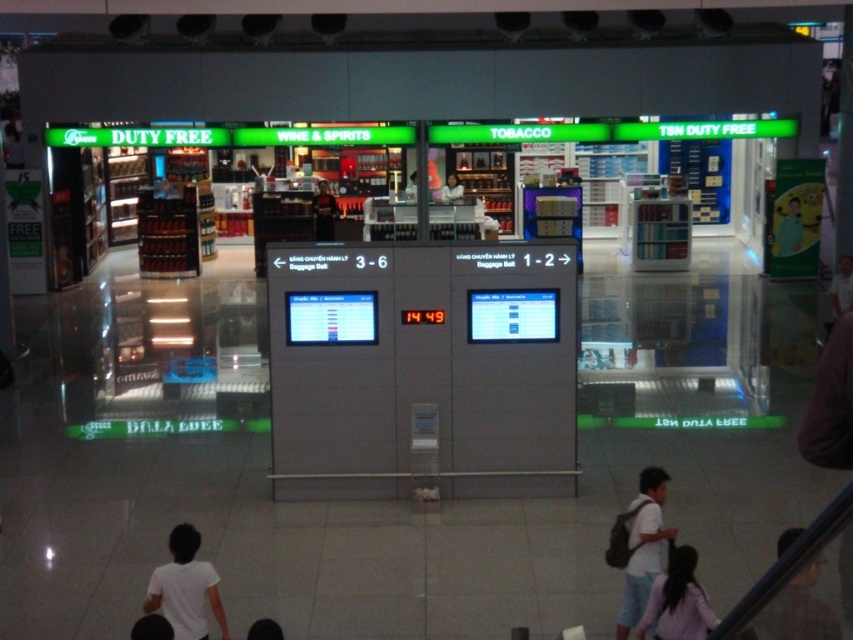
Can you confirm if white matte shirt at lower left is positioned above white cotton shirt at lower right?

No, white matte shirt at lower left is not above white cotton shirt at lower right.

Which is behind, point (218, 602) or point (637, 536)?

Positioned behind is point (637, 536).

Where is `white matte shirt at lower left`? The width and height of the screenshot is (853, 640). white matte shirt at lower left is located at coordinates (184, 588).

Between white matte shirt at lower left and light pink fabric at lower right, which one appears on the left side from the viewer's perspective?

From the viewer's perspective, white matte shirt at lower left appears more on the left side.

Who is positioned more to the right, white matte shirt at lower left or light pink fabric at lower right?

From the viewer's perspective, light pink fabric at lower right appears more on the right side.

Between point (178, 560) and point (646, 605), which one is positioned in front?

Positioned in front is point (178, 560).

Where is `white matte shirt at lower left`? This screenshot has width=853, height=640. white matte shirt at lower left is located at coordinates (184, 588).

In the scene shown: Between white matte shirt at lower left and smooth white shirt at center, which one is positioned lower?

white matte shirt at lower left

Between white matte shirt at lower left and smooth white shirt at center, which one appears on the right side from the viewer's perspective?

smooth white shirt at center

Locate an element on the screen. This screenshot has width=853, height=640. white matte shirt at lower left is located at coordinates (184, 588).